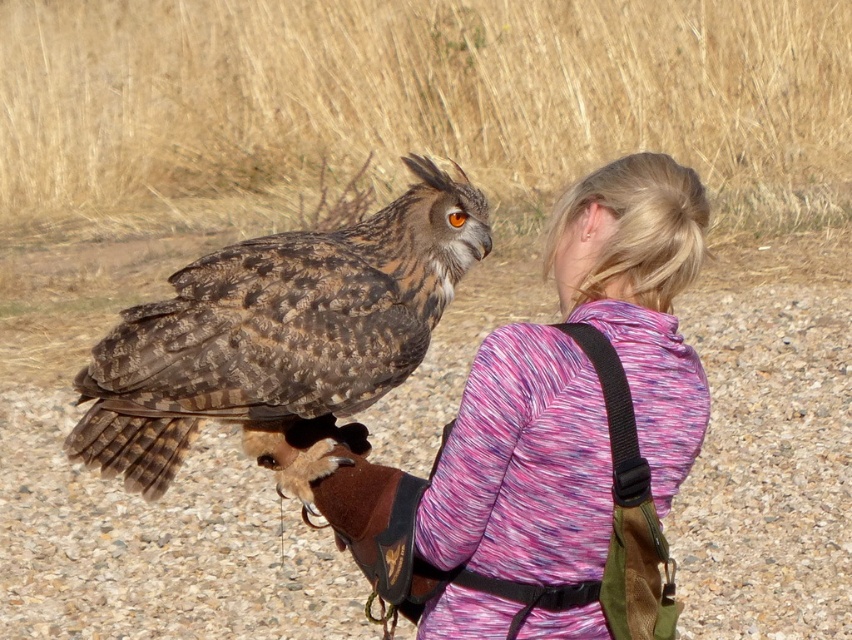
Question: Is multicolored fleece at center wider than brown speckled owl at center?

Choices:
 (A) no
 (B) yes

Answer: (A)

Question: Which object is farther from the camera taking this photo?

Choices:
 (A) brown speckled owl at center
 (B) multicolored fleece at center
 (C) brown textured glove at center

Answer: (C)

Question: Which object is farther from the camera taking this photo?

Choices:
 (A) brown textured glove at center
 (B) multicolored fleece at center

Answer: (A)

Question: Does multicolored fleece at center appear on the left side of brown speckled owl at center?

Choices:
 (A) yes
 (B) no

Answer: (B)

Question: Is brown textured glove at center closer to the viewer compared to multicolored fleece at center?

Choices:
 (A) no
 (B) yes

Answer: (A)

Question: Which is nearer to the multicolored fleece at center?

Choices:
 (A) brown textured glove at center
 (B) brown speckled owl at center

Answer: (B)